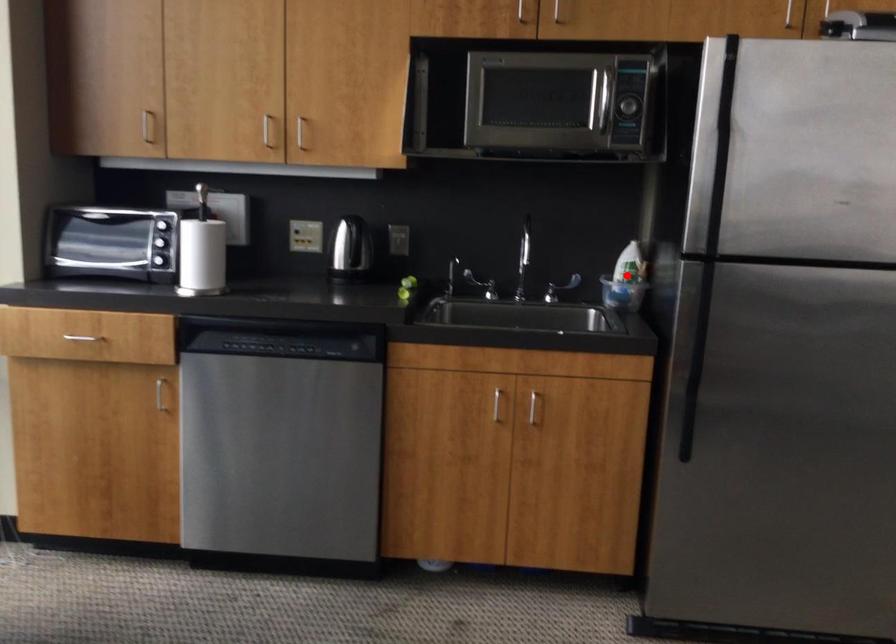
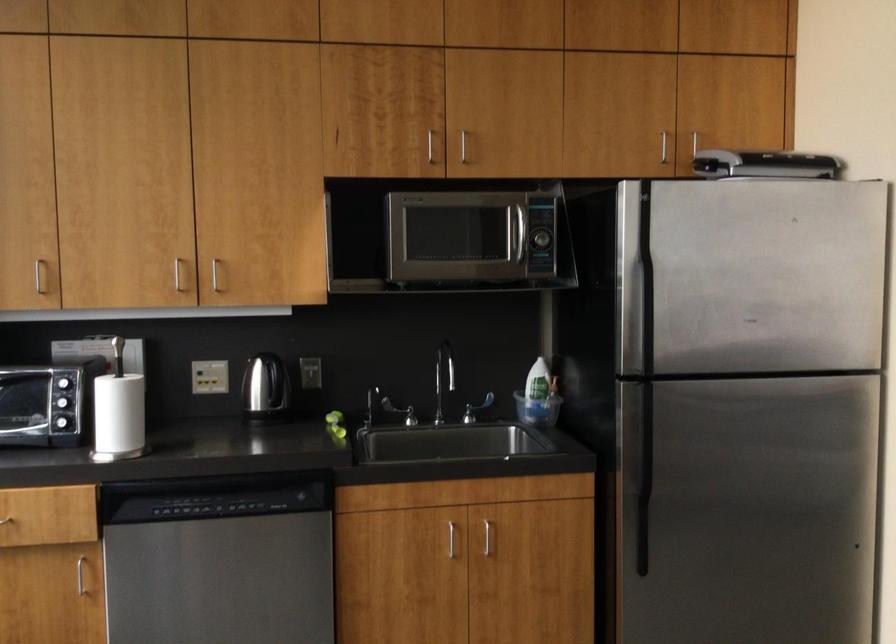
Find the pixel in the second image that matches the highlighted location in the first image.

(539, 391)